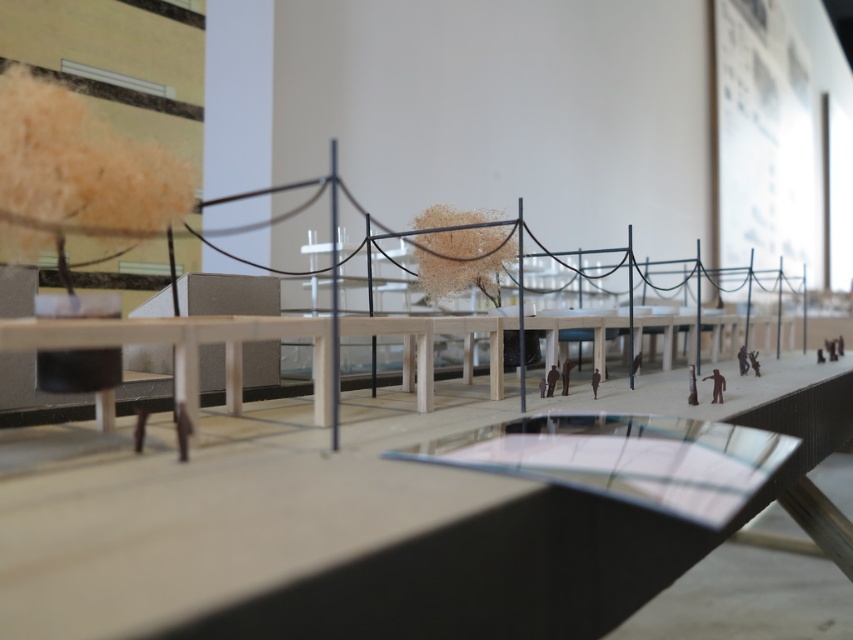
Is brown matte figure at center above dark brown fabric figure at center?

Yes.

Does brown matte figure at center appear on the right side of dark brown fabric figure at center?

No, brown matte figure at center is not to the right of dark brown fabric figure at center.

Locate an element on the screen. Image resolution: width=853 pixels, height=640 pixels. brown matte figure at center is located at coordinates (550, 380).

Is brown matte figure at center-right taller than dark brown fabric figure at center?

Yes, brown matte figure at center-right is taller than dark brown fabric figure at center.

Is point (717, 381) behind point (595, 392)?

No, (717, 381) is closer to viewer.

In order to click on brown matte figure at center-right in this screenshot , I will do `click(717, 385)`.

Is point (721, 396) more distant than point (738, 355)?

No, (721, 396) is closer to viewer.

Measure the distance between brown matte figure at center-right and camera.

brown matte figure at center-right is 33.34 inches from camera.

You are a GUI agent. You are given a task and a screenshot of the screen. Output one action in this format:
    pyautogui.click(x=<x>, y=<y>)
    Task: Click on the brown matte figure at center-right
    The image size is (853, 640).
    Given the screenshot: What is the action you would take?
    pyautogui.click(x=717, y=385)